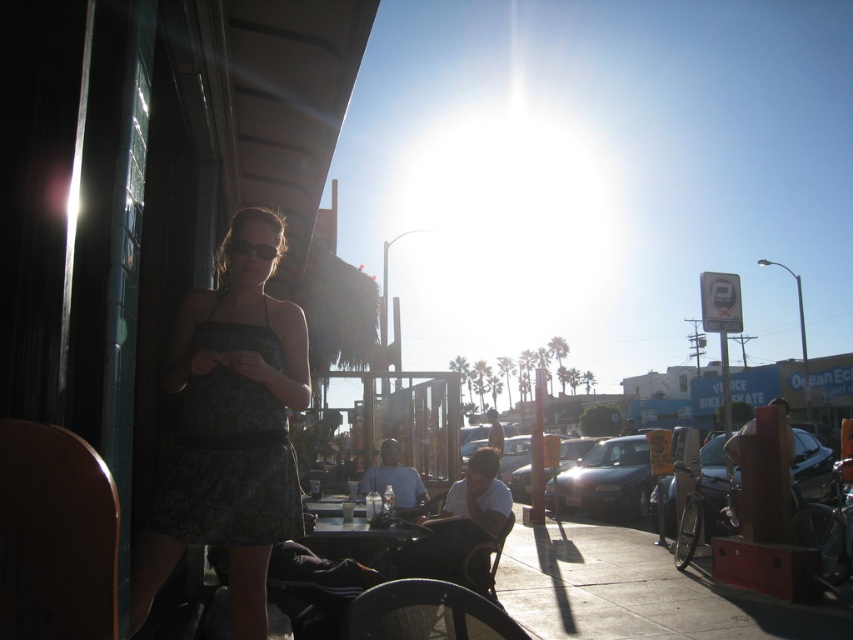
Image resolution: width=853 pixels, height=640 pixels. In order to click on matte black dress at left in this screenshot , I will do `click(230, 426)`.

Identify the location of matte black dress at left. (230, 426).